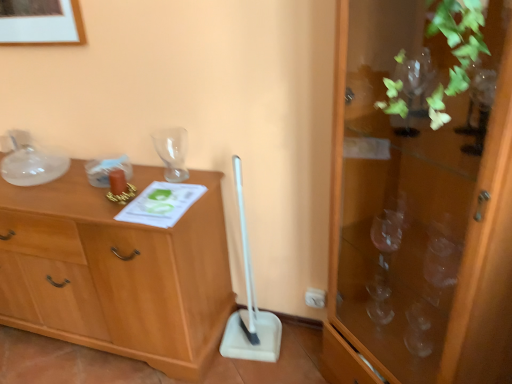
This screenshot has height=384, width=512. What are the coordinates of `free point to the right of white plastic shovel at center` in the screenshot? It's located at (302, 347).